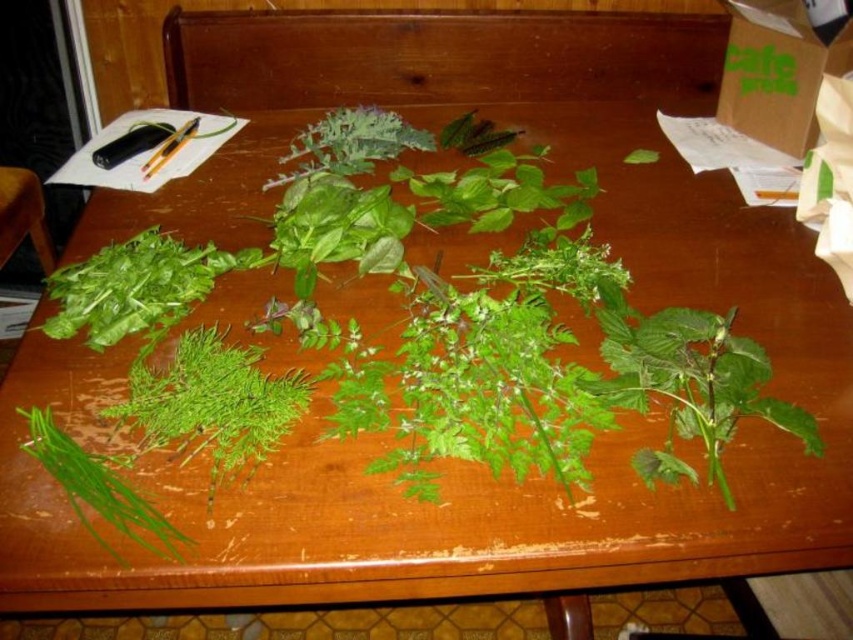
You are organizing herbs on a wooden table and see two green leafy items. One is labeled as green leafy at left and the other as green leafy at lower left. Which one is closer to you?

The green leafy at left is closer to you because the green leafy at lower left is behind it.

You are a chef preparing a garnish for a dish and have two green leafy herbs on the table. You need to choose the wider one for the presentation. Which one should you pick between the green leafy at left and the green leafy at lower left?

The green leafy at left has a larger width than the green leafy at lower left, so you should pick the green leafy at left for the presentation.

You are a chef preparing a dish and need to locate the herbs on the wooden table. According to the image, where exactly is the green leafy at left positioned?

The green leafy at left is positioned at point 0.628 on the x axis and 0.250 on the y axis.